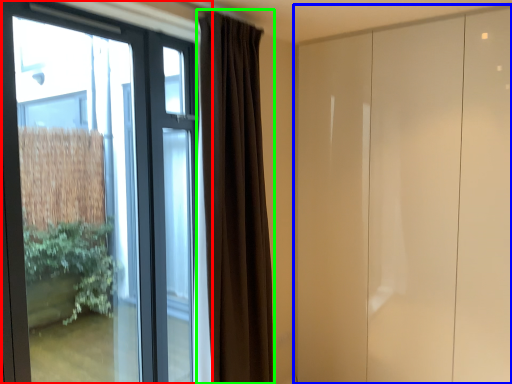
Question: Considering the real-world distances, which object is farthest from window (highlighted by a red box)? door (highlighted by a blue box) or curtain (highlighted by a green box)?

Choices:
 (A) door
 (B) curtain

Answer: (A)